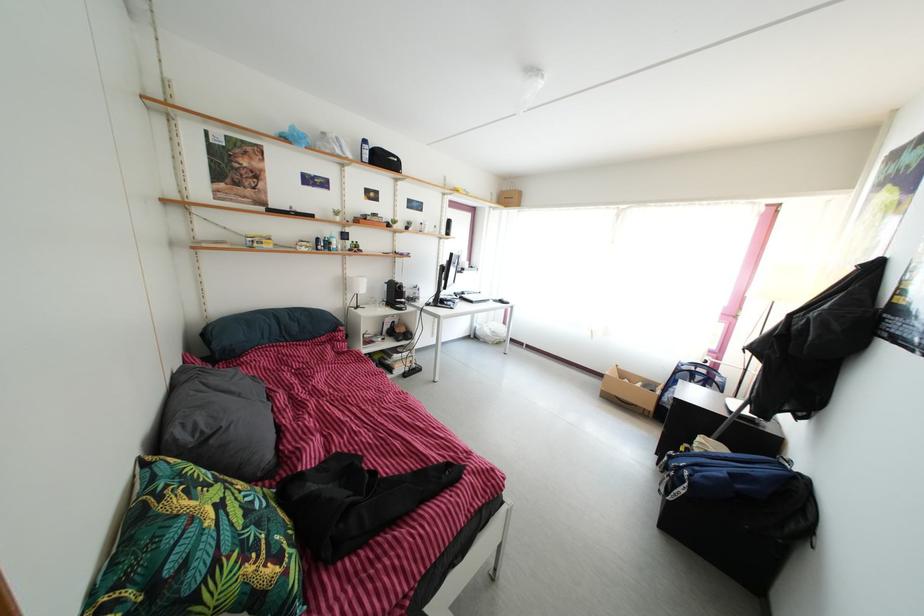
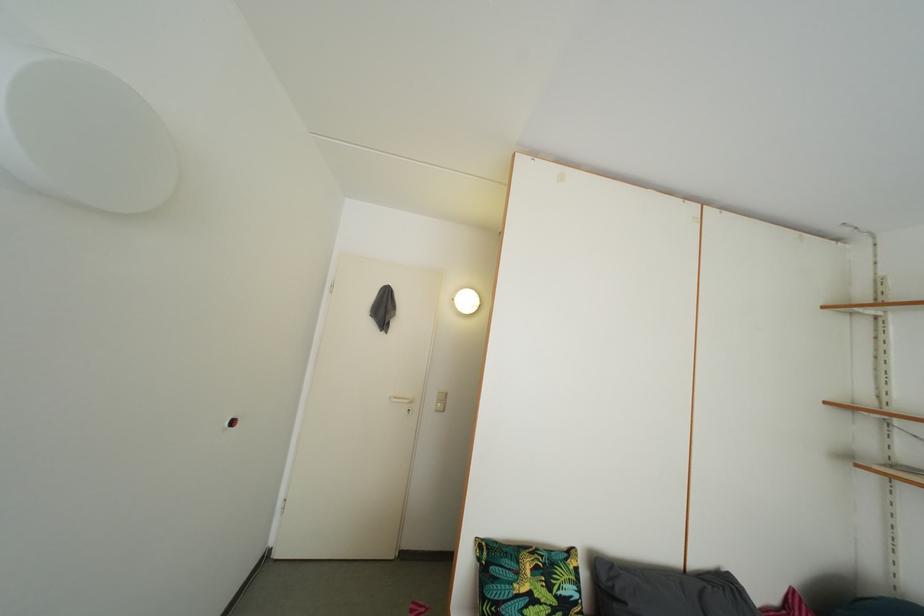
In the second image, find the point that corresponds to point 215,440 in the first image.

(624, 601)